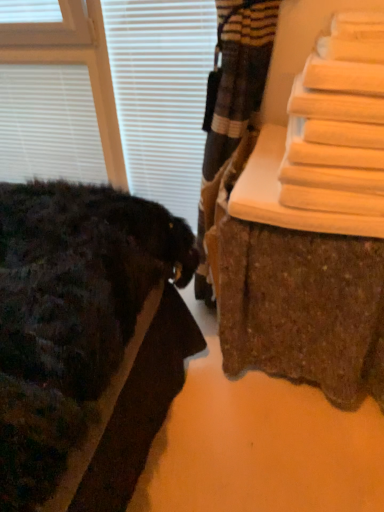
Question: Would you say white matte blinds at upper left, placed as the 2th blind when sorted from right to left, is part of white matte blind at upper left, positioned as the 1th blind in right-to-left order,'s contents?

Choices:
 (A) yes
 (B) no

Answer: (B)

Question: Could you tell me if white matte blind at upper left, marked as the 2th blind in a left-to-right arrangement, is facing white matte blinds at upper left, which is the first blind from left to right?

Choices:
 (A) no
 (B) yes

Answer: (A)

Question: Is white matte blind at upper left, marked as the 2th blind in a left-to-right arrangement, outside of white matte blinds at upper left, placed as the 2th blind when sorted from right to left?

Choices:
 (A) no
 (B) yes

Answer: (B)

Question: Can you confirm if white matte blind at upper left, positioned as the 1th blind in right-to-left order, is positioned to the left of white matte blinds at upper left, placed as the 2th blind when sorted from right to left?

Choices:
 (A) yes
 (B) no

Answer: (B)

Question: Is white matte blind at upper left, marked as the 2th blind in a left-to-right arrangement, shorter than white matte blinds at upper left, placed as the 2th blind when sorted from right to left?

Choices:
 (A) no
 (B) yes

Answer: (A)

Question: Considering the positions of white matte blinds at upper left, placed as the 2th blind when sorted from right to left, and wooden bench at right in the image, is white matte blinds at upper left, placed as the 2th blind when sorted from right to left, wider or thinner than wooden bench at right?

Choices:
 (A) thin
 (B) wide

Answer: (A)

Question: Is white matte blinds at upper left, which is the first blind from left to right, taller or shorter than wooden bench at right?

Choices:
 (A) short
 (B) tall

Answer: (B)

Question: Relative to wooden bench at right, is white matte blinds at upper left, placed as the 2th blind when sorted from right to left, in front or behind?

Choices:
 (A) behind
 (B) front

Answer: (A)

Question: Do you think white matte blinds at upper left, placed as the 2th blind when sorted from right to left, is within wooden bench at right, or outside of it?

Choices:
 (A) inside
 (B) outside

Answer: (B)

Question: Is point (147, 118) closer or farther from the camera than point (244, 291)?

Choices:
 (A) farther
 (B) closer

Answer: (A)

Question: Is white matte blind at upper left, marked as the 2th blind in a left-to-right arrangement, in front of or behind wooden bench at right in the image?

Choices:
 (A) behind
 (B) front

Answer: (A)

Question: Looking at their shapes, would you say white matte blind at upper left, marked as the 2th blind in a left-to-right arrangement, is wider or thinner than wooden bench at right?

Choices:
 (A) wide
 (B) thin

Answer: (B)

Question: Do you think white matte blind at upper left, positioned as the 1th blind in right-to-left order, is within wooden bench at right, or outside of it?

Choices:
 (A) inside
 (B) outside

Answer: (B)

Question: From a real-world perspective, is white matte blinds at upper left, which is the first blind from left to right, above or below white matte blind at upper left, marked as the 2th blind in a left-to-right arrangement?

Choices:
 (A) above
 (B) below

Answer: (B)

Question: From the image's perspective, is white matte blinds at upper left, which is the first blind from left to right, located above or below white matte blind at upper left, positioned as the 1th blind in right-to-left order?

Choices:
 (A) below
 (B) above

Answer: (B)